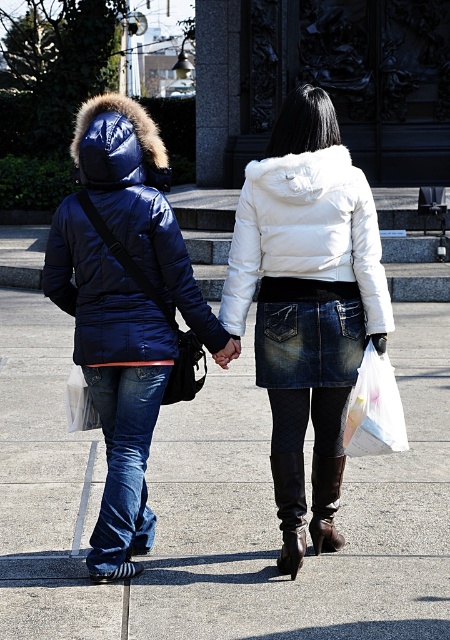
You are a photographer trying to capture a closeup of the smooth concrete pavement at center and the denim skirt at center. Given that your camera can only focus on one object at a time, which object should you choose to ensure the larger one is in focus?

The smooth concrete pavement at center is larger in size than the denim skirt at center, so you should focus on the smooth concrete pavement at center to ensure the larger object is in focus.

You are a photographer trying to capture both the white fluffy coat at center and the denim skirt at center in a single frame. Based on their sizes, which object should you focus on first to ensure both are in the frame?

The white fluffy coat at center is larger than the denim skirt at center, so you should focus on the white fluffy coat at center first to ensure both fit in the frame.